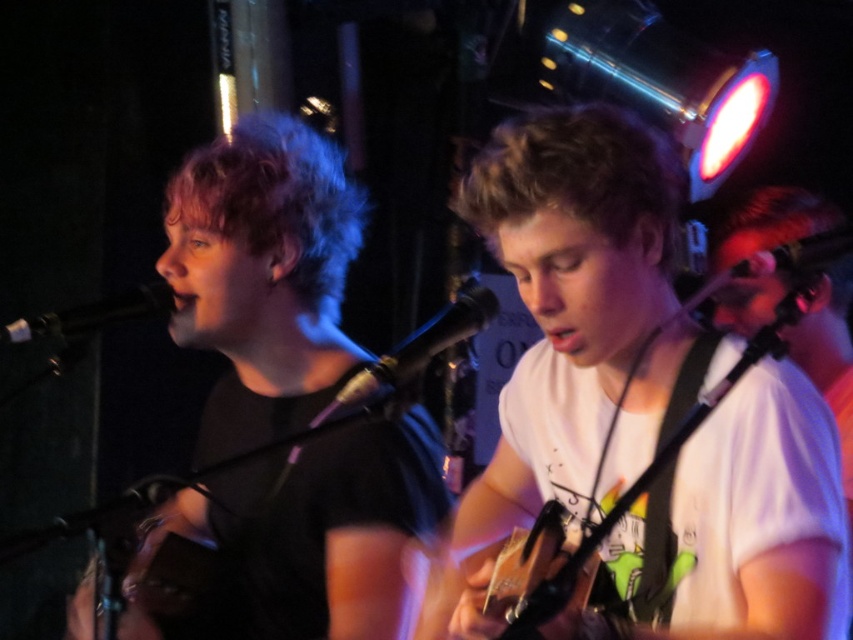
You are a stagehand adjusting the lighting for the performance. You need to ensure that the wooden acoustic guitar at center is fully illuminated. Since the black metallic microphone at left is in the way, where should you position the light source relative to the microphone to avoid casting a shadow on the guitar?

The wooden acoustic guitar at center is positioned under the black metallic microphone at left, so positioning the light source above the microphone would prevent its shadow from falling on the guitar.

You are a photographer in the audience trying to capture a clear shot of the wooden acoustic guitar at center and the black metallic microphone at left. Which object will appear larger in your photo?

The wooden acoustic guitar at center is closer to the viewer than the black metallic microphone at left, so it will appear larger in the photo.

You are a sound technician setting up for a live performance. You need to decide which microphone to use for the lead vocalist based on their preference for a larger microphone. Given the black metallic microphone at left and the metallic silver microphone at upper right, which one should you choose?

The black metallic microphone at left is larger in size than the metallic silver microphone at upper right, so you should choose the black metallic microphone at left for the lead vocalist.